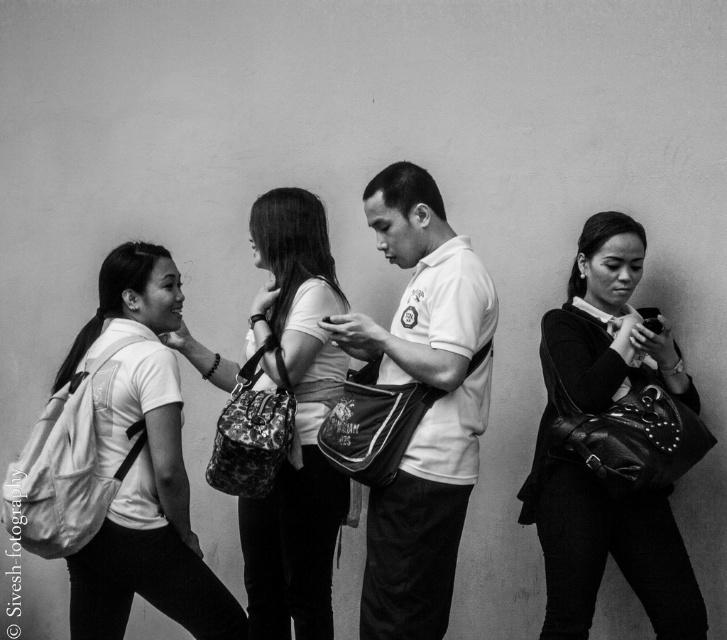
You are organizing a charity event and need to decide which item to place on a narrow shelf. The shelf can only accommodate items narrower than the white fabric backpack at left. Based on the scene, can the leather handbag at center fit on the shelf?

The leather handbag at center has a lesser width compared to the white fabric backpack at left, so it can fit on the shelf since it is narrower than the backpack.

Based on the scene described, which object is positioned to the right of the other between the white matte shirt at center and the white fabric backpack at left?

The white matte shirt at center is positioned to the right of the white fabric backpack at left.

In the scene shown: Based on the scene description, where is the white matte shirt at center located in the image?

The white matte shirt at center is located at point (427, 410).